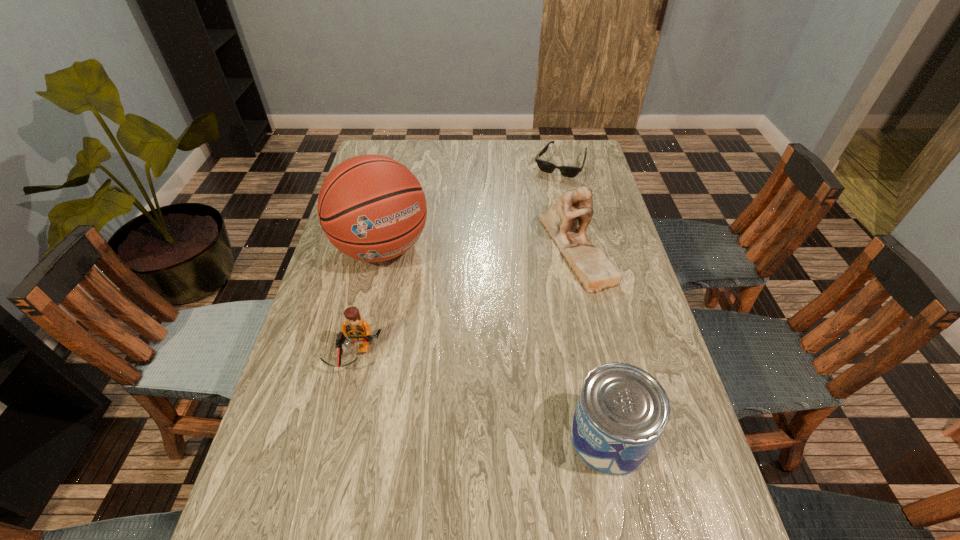
I want to click on vacant space located on the front label of the nearest object, so click(384, 437).

Locate an element on the screen. This screenshot has width=960, height=540. vacant space located on the front label of the nearest object is located at coordinates (482, 437).

Identify the location of vacant region located on the front-facing side of the second tallest object. (528, 370).

This screenshot has height=540, width=960. What are the coordinates of `vacant space positioned on the front-facing side of the second tallest object` in the screenshot? It's located at (531, 364).

The width and height of the screenshot is (960, 540). I want to click on free space located 0.310m on the front-facing side of the second tallest object, so click(526, 373).

This screenshot has height=540, width=960. I want to click on free region located on the front-facing side of the shortest object, so click(x=533, y=217).

This screenshot has width=960, height=540. In order to click on free space located 0.250m on the front-facing side of the shortest object in this screenshot , I will do `click(532, 219)`.

Locate an element on the screen. The width and height of the screenshot is (960, 540). free location located 0.200m on the front-facing side of the shortest object is located at coordinates (537, 211).

Locate an element on the screen. The height and width of the screenshot is (540, 960). vacant position located 0.320m on the logo side of the basketball is located at coordinates (455, 359).

Where is `vacant space situated 0.180m on the logo side of the basketball`? The image size is (960, 540). vacant space situated 0.180m on the logo side of the basketball is located at coordinates (429, 320).